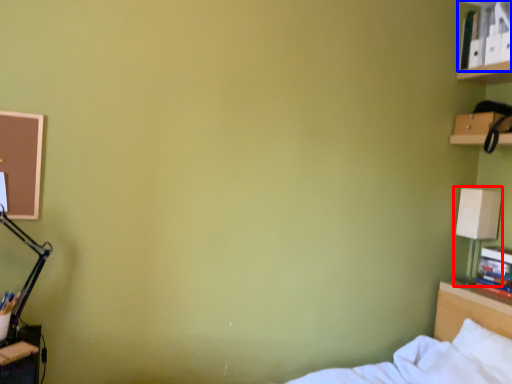
Question: Which point is closer to the camera, table lamp (highlighted by a red box) or book (highlighted by a blue box)?

Choices:
 (A) table lamp
 (B) book

Answer: (B)